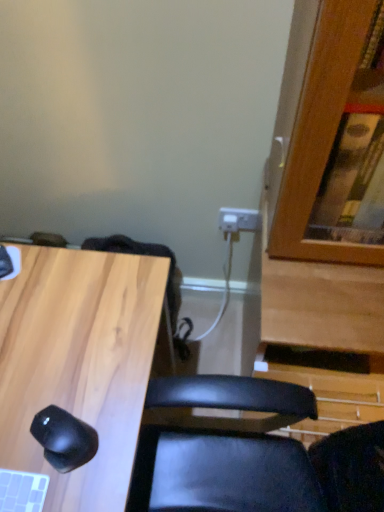
Find the location of `empty space that is ontop of light wood/black mouse at lower left (from a real-world perspective)`. empty space that is ontop of light wood/black mouse at lower left (from a real-world perspective) is located at coordinates (50, 354).